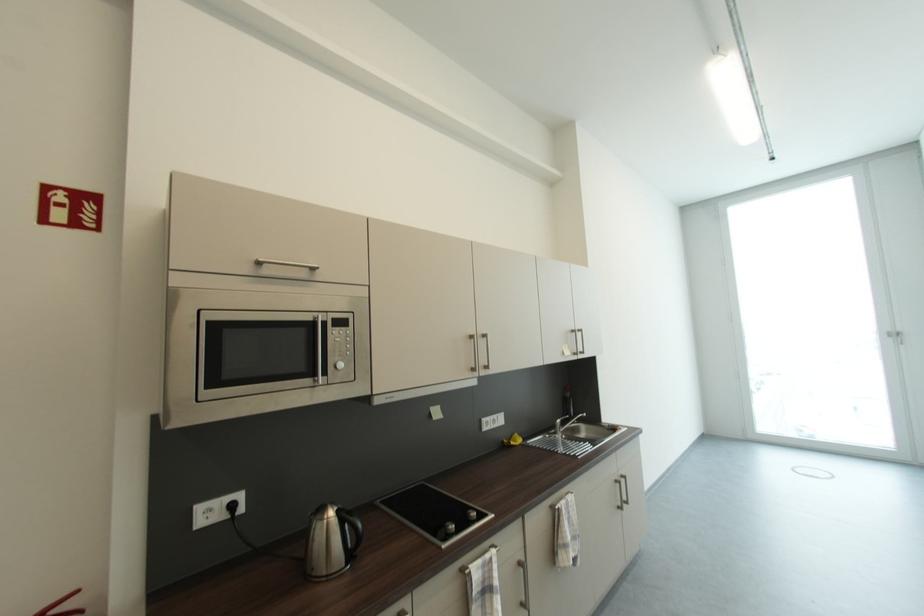
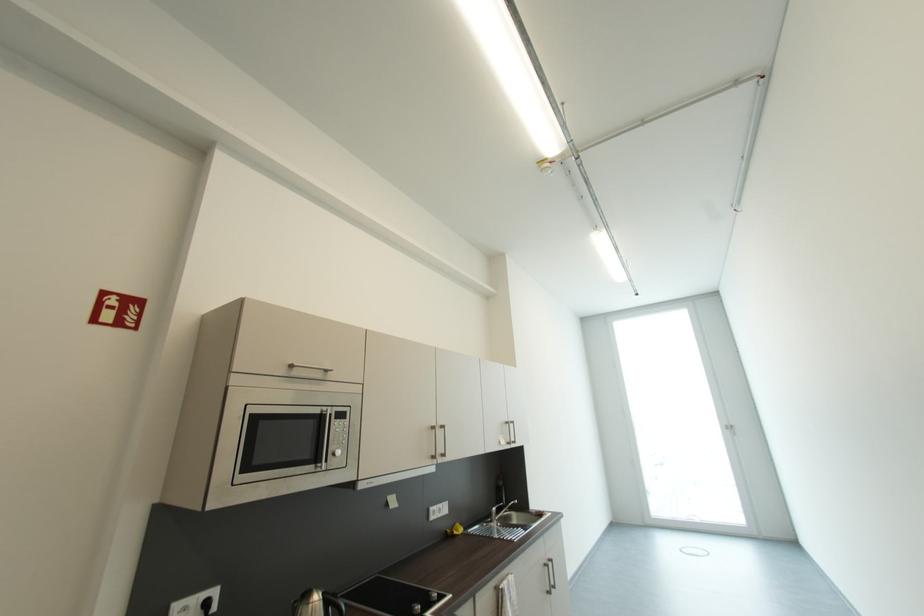
Locate, in the second image, the point that corresponds to point 511,444 in the first image.

(454, 533)